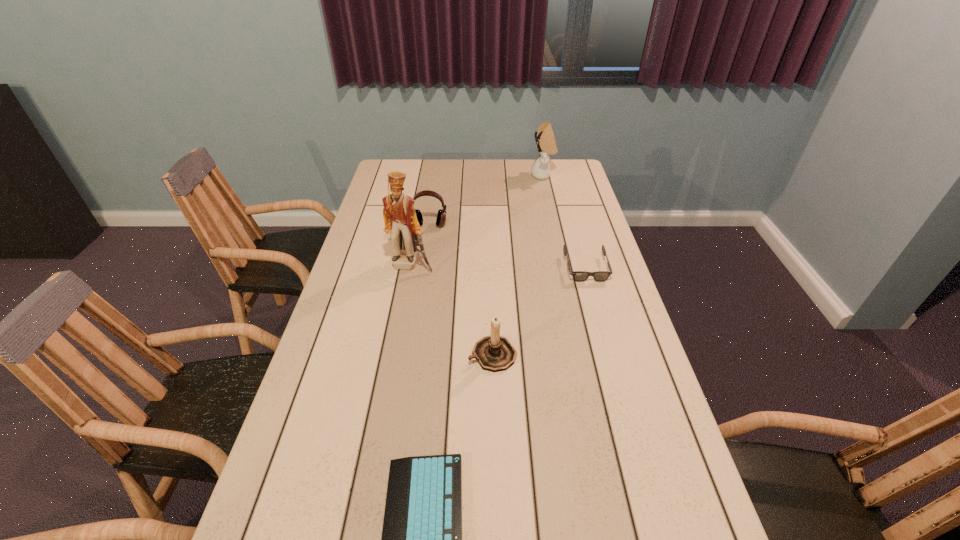
Where is `nutcracker`? Image resolution: width=960 pixels, height=540 pixels. nutcracker is located at coordinates (400, 219).

The width and height of the screenshot is (960, 540). In order to click on doll in this screenshot , I will do `click(546, 144)`.

At what (x,y) coordinates should I click in order to perform the action: click on the farthest object. Please return your answer as a coordinate pair (x, y). The width and height of the screenshot is (960, 540). Looking at the image, I should click on (546, 144).

The width and height of the screenshot is (960, 540). Identify the location of the second nearest object. (494, 353).

Locate an element on the screen. The height and width of the screenshot is (540, 960). the fifth nearest object is located at coordinates (441, 216).

This screenshot has width=960, height=540. What are the coordinates of `the second shortest object` in the screenshot? It's located at (579, 276).

Image resolution: width=960 pixels, height=540 pixels. In order to click on vacant point located 0.070m on the front-facing side of the nutcracker in this screenshot , I will do `click(407, 288)`.

At what (x,y) coordinates should I click in order to perform the action: click on vacant space located at the front face of the doll. Please return your answer as a coordinate pair (x, y). This screenshot has width=960, height=540. Looking at the image, I should click on (501, 176).

Find the location of a particular element. blank space located at the front face of the doll is located at coordinates pyautogui.click(x=508, y=176).

Find the location of `vacant area located at the front face of the doll`. vacant area located at the front face of the doll is located at coordinates (475, 176).